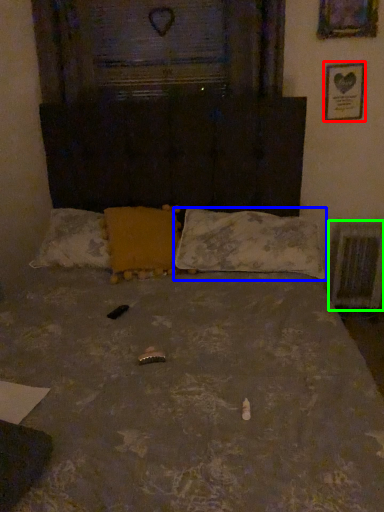
Question: Based on their relative distances, which object is nearer to picture frame (highlighted by a red box)? Choose from pillow (highlighted by a blue box) and radiator (highlighted by a green box).

Choices:
 (A) pillow
 (B) radiator

Answer: (B)